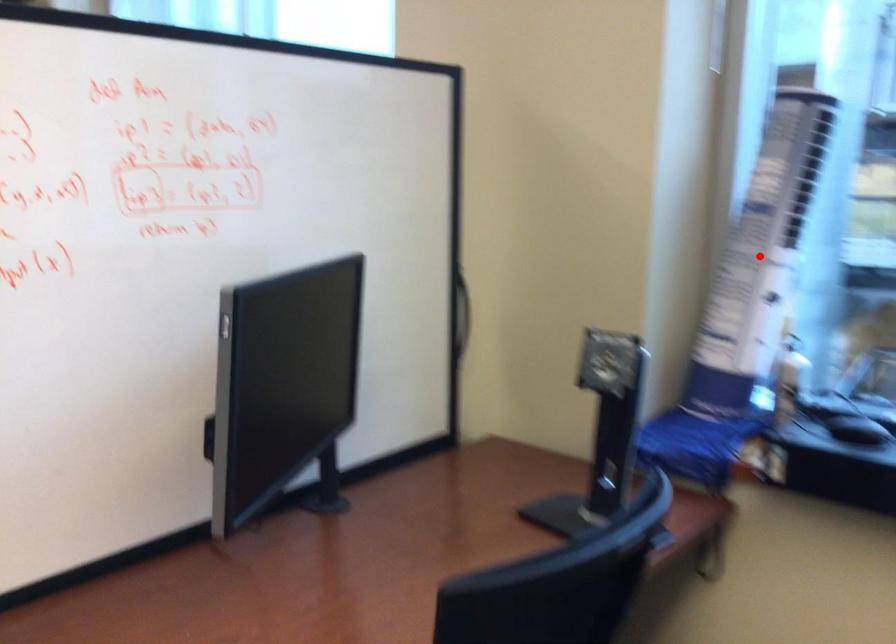
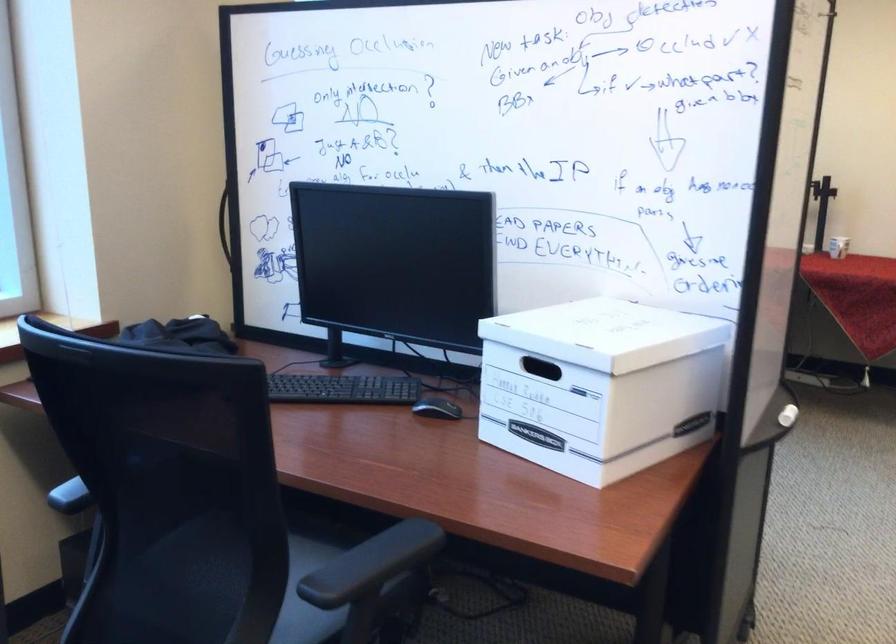
Question: I am providing you with two images of the same scene from different viewpoints. A red point is marked on the first image. Can you still see the location of the red point in image 2?

Choices:
 (A) Yes
 (B) No

Answer: (B)